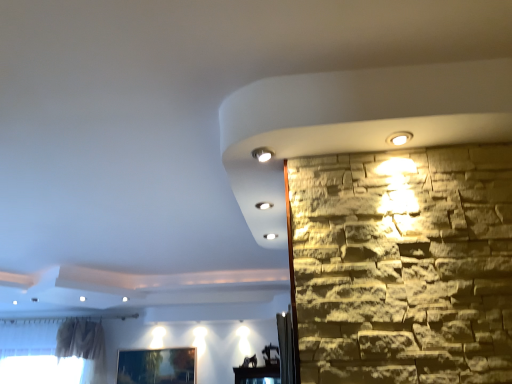
Measure the distance between point (256, 148) and camera.

They are 4.09 feet apart.

You are a GUI agent. You are given a task and a screenshot of the screen. Output one action in this format:
    pyautogui.click(x=<x>, y=<y>)
    Task: Click on the matte white spotlight at upper center
    Image resolution: width=512 pixels, height=384 pixels.
    Given the screenshot: What is the action you would take?
    pyautogui.click(x=262, y=154)

What do you see at coordinates (262, 154) in the screenshot? The image size is (512, 384). I see `matte white spotlight at upper center` at bounding box center [262, 154].

Identify the location of metallic silver picture frame at lower left. (156, 366).

This screenshot has width=512, height=384. Describe the element at coordinates (156, 366) in the screenshot. I see `metallic silver picture frame at lower left` at that location.

Where is `matte white spotlight at upper center`? The height and width of the screenshot is (384, 512). matte white spotlight at upper center is located at coordinates (262, 154).

Can you confirm if metallic silver picture frame at lower left is positioned to the right of matte white spotlight at upper center?

No.

Is metallic silver picture frame at lower left closer to camera compared to matte white spotlight at upper center?

No, metallic silver picture frame at lower left is further to the viewer.

Which point is more distant from viewer, (145,382) or (256,157)?

The point (145,382) is behind.

Consider the image. From the image's perspective, between metallic silver picture frame at lower left and matte white spotlight at upper center, which one is located above?

matte white spotlight at upper center appears higher in the image.

From a real-world perspective, is metallic silver picture frame at lower left located beneath matte white spotlight at upper center?

Correct, in the physical world, metallic silver picture frame at lower left is lower than matte white spotlight at upper center.

Can you confirm if metallic silver picture frame at lower left is wider than matte white spotlight at upper center?

In fact, metallic silver picture frame at lower left might be narrower than matte white spotlight at upper center.

Considering the relative sizes of metallic silver picture frame at lower left and matte white spotlight at upper center in the image provided, is metallic silver picture frame at lower left taller than matte white spotlight at upper center?

Yes.

Considering the relative sizes of metallic silver picture frame at lower left and matte white spotlight at upper center in the image provided, is metallic silver picture frame at lower left smaller than matte white spotlight at upper center?

No.

Looking at this image, would you say metallic silver picture frame at lower left contains matte white spotlight at upper center?

No.

Is metallic silver picture frame at lower left placed right next to matte white spotlight at upper center?

There is a gap between metallic silver picture frame at lower left and matte white spotlight at upper center.

Is matte white spotlight at upper center at the back of metallic silver picture frame at lower left?

metallic silver picture frame at lower left is not turned away from matte white spotlight at upper center.

Can you tell me how much metallic silver picture frame at lower left and matte white spotlight at upper center differ in facing direction?

The angular difference between metallic silver picture frame at lower left and matte white spotlight at upper center is 86.6 degrees.

This screenshot has height=384, width=512. What are the coordinates of `picture frame on the left of matte white spotlight at upper center` in the screenshot? It's located at (156, 366).

In the image, is matte white spotlight at upper center on the left side or the right side of metallic silver picture frame at lower left?

matte white spotlight at upper center is to the right of metallic silver picture frame at lower left.

Is matte white spotlight at upper center further to camera compared to metallic silver picture frame at lower left?

No, matte white spotlight at upper center is closer to the camera.

Which is closer to the camera, [260,161] or [125,362]?

Positioned in front is point [260,161].

From the image's perspective, is matte white spotlight at upper center located above or below metallic silver picture frame at lower left?

matte white spotlight at upper center is above metallic silver picture frame at lower left.

From the picture: From a real-world perspective, is matte white spotlight at upper center positioned over metallic silver picture frame at lower left based on gravity?

Yes, from a real-world perspective, matte white spotlight at upper center is above metallic silver picture frame at lower left.

Considering the sizes of objects matte white spotlight at upper center and metallic silver picture frame at lower left in the image provided, who is wider, matte white spotlight at upper center or metallic silver picture frame at lower left?

With larger width is matte white spotlight at upper center.

Which of these two, matte white spotlight at upper center or metallic silver picture frame at lower left, stands taller?

With more height is metallic silver picture frame at lower left.

Who is bigger, matte white spotlight at upper center or metallic silver picture frame at lower left?

metallic silver picture frame at lower left is bigger.

Would you say matte white spotlight at upper center is inside or outside metallic silver picture frame at lower left?

matte white spotlight at upper center is outside metallic silver picture frame at lower left.

Would you consider matte white spotlight at upper center to be distant from metallic silver picture frame at lower left?

Yes, matte white spotlight at upper center is far from metallic silver picture frame at lower left.

Is matte white spotlight at upper center oriented away from metallic silver picture frame at lower left?

No, matte white spotlight at upper center's orientation is not away from metallic silver picture frame at lower left.

From the picture: How distant is matte white spotlight at upper center from metallic silver picture frame at lower left?

They are 5.38 meters apart.

The width and height of the screenshot is (512, 384). I want to click on light that appears on the right of metallic silver picture frame at lower left, so click(x=262, y=154).

At what (x,y) coordinates should I click in order to perform the action: click on light that appears in front of the metallic silver picture frame at lower left. Please return your answer as a coordinate pair (x, y). The height and width of the screenshot is (384, 512). Looking at the image, I should click on (262, 154).

Identify the location of light above the metallic silver picture frame at lower left (from the image's perspective). The height and width of the screenshot is (384, 512). click(262, 154).